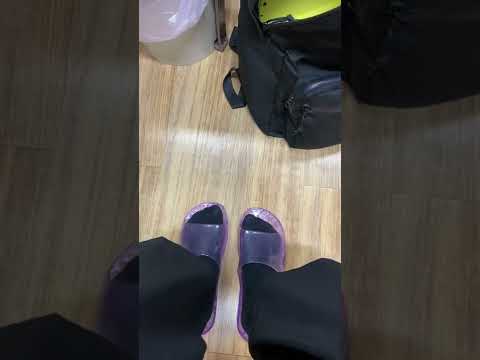
Find the location of a particular element. left slipper is located at coordinates (190, 225).